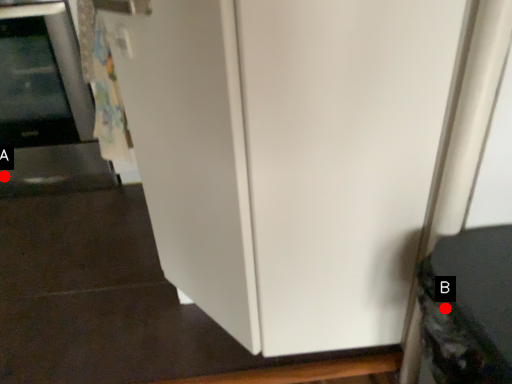
Question: Two points are circled on the image, labeled by A and B beside each circle. Among these points, which one is farthest from the camera?

Choices:
 (A) A is further
 (B) B is further

Answer: (A)